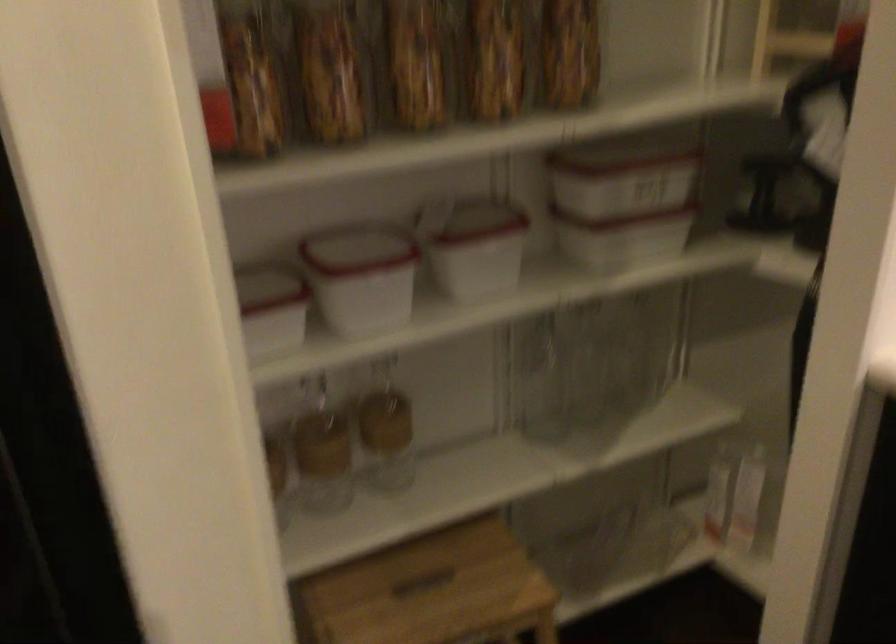
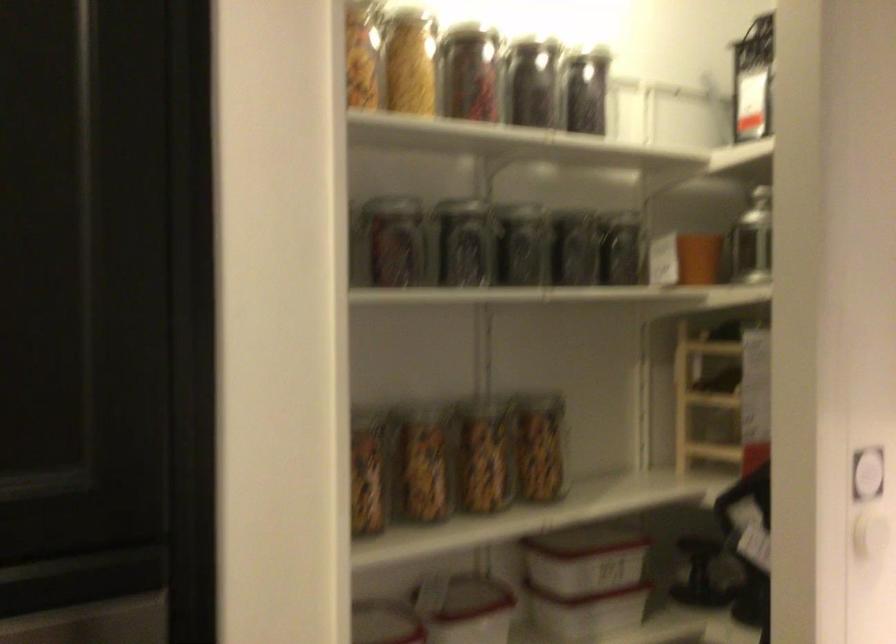
Where in the second image is the point corresponding to (613,192) from the first image?

(582, 572)